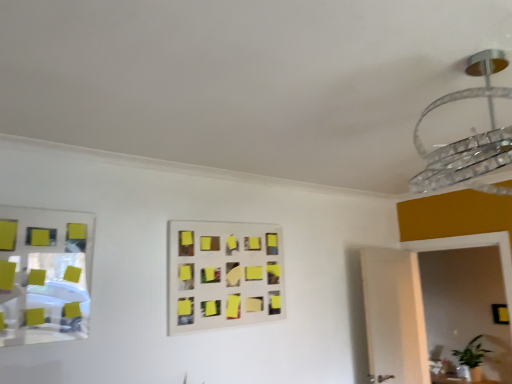
I want to click on metallic reflective mirror at left, so click(x=44, y=274).

The width and height of the screenshot is (512, 384). What do you see at coordinates (467, 137) in the screenshot? I see `clear glass chandelier at upper right` at bounding box center [467, 137].

This screenshot has width=512, height=384. What are the coordinates of `metallic reflective mirror at left` in the screenshot? It's located at (44, 274).

Who is taller, clear glass chandelier at upper right or black matte square at lower right?

clear glass chandelier at upper right is taller.

Is clear glass chandelier at upper right not inside black matte square at lower right?

Indeed, clear glass chandelier at upper right is completely outside black matte square at lower right.

Which of these two, clear glass chandelier at upper right or black matte square at lower right, is smaller?

With smaller size is black matte square at lower right.

Which object is wider, clear glass chandelier at upper right or black matte square at lower right?

With larger width is clear glass chandelier at upper right.

In terms of height, does black matte square at lower right look taller or shorter compared to yellow sticky notes at center?

In the image, black matte square at lower right appears to be shorter than yellow sticky notes at center.

Does black matte square at lower right lie behind yellow sticky notes at center?

That is True.

Choose the correct answer: Is black matte square at lower right inside yellow sticky notes at center or outside it?

black matte square at lower right cannot be found inside yellow sticky notes at center.

From the image's perspective, is black matte square at lower right located above or below yellow sticky notes at center?

From the image's perspective, black matte square at lower right appears below yellow sticky notes at center.

Is yellow sticky notes at center to the left of clear glass chandelier at upper right from the viewer's perspective?

Yes.

Considering the relative sizes of yellow sticky notes at center and clear glass chandelier at upper right in the image provided, is yellow sticky notes at center taller than clear glass chandelier at upper right?

Yes, yellow sticky notes at center is taller than clear glass chandelier at upper right.

Is yellow sticky notes at center bigger than clear glass chandelier at upper right?

Actually, yellow sticky notes at center might be smaller than clear glass chandelier at upper right.

From a real-world perspective, which object rests below the other?

In real-world perspective, yellow sticky notes at center is lower.

Considering the relative sizes of black matte square at lower right and metallic reflective mirror at left in the image provided, is black matte square at lower right taller than metallic reflective mirror at left?

In fact, black matte square at lower right may be shorter than metallic reflective mirror at left.

Measure the distance from black matte square at lower right to metallic reflective mirror at left.

The distance of black matte square at lower right from metallic reflective mirror at left is 3.98 meters.

Does point (504, 311) appear closer or farther from the camera than point (81, 240)?

Point (504, 311) is farther from the camera than point (81, 240).

Which of these two, black matte square at lower right or metallic reflective mirror at left, is smaller?

black matte square at lower right is smaller.

From the image's perspective, is yellow sticky notes at center positioned above or below black matte square at lower right?

Based on their image positions, yellow sticky notes at center is located above black matte square at lower right.

Considering the relative positions of yellow sticky notes at center and black matte square at lower right in the image provided, is yellow sticky notes at center behind black matte square at lower right?

That is False.

Considering the relative sizes of yellow sticky notes at center and black matte square at lower right in the image provided, is yellow sticky notes at center shorter than black matte square at lower right?

No, yellow sticky notes at center is not shorter than black matte square at lower right.

The width and height of the screenshot is (512, 384). Find the location of `square lying below the yellow sticky notes at center (from the image's perspective)`. square lying below the yellow sticky notes at center (from the image's perspective) is located at coordinates tap(500, 313).

Considering the sizes of objects clear glass chandelier at upper right and yellow sticky notes at center in the image provided, who is bigger, clear glass chandelier at upper right or yellow sticky notes at center?

clear glass chandelier at upper right is bigger.

Are clear glass chandelier at upper right and yellow sticky notes at center far apart?

Indeed, clear glass chandelier at upper right is not near yellow sticky notes at center.

Does point (416, 181) come in front of point (202, 291)?

Yes, it is.

Consider the image. Can you confirm if clear glass chandelier at upper right is taller than yellow sticky notes at center?

No, clear glass chandelier at upper right is not taller than yellow sticky notes at center.

Which of these two, clear glass chandelier at upper right or metallic reflective mirror at left, is thinner?

With smaller width is metallic reflective mirror at left.

Which object is further away from the camera taking this photo, clear glass chandelier at upper right or metallic reflective mirror at left?

metallic reflective mirror at left.

From the image's perspective, is clear glass chandelier at upper right located above or below metallic reflective mirror at left?

clear glass chandelier at upper right is situated higher than metallic reflective mirror at left in the image.

The width and height of the screenshot is (512, 384). I want to click on square beneath the clear glass chandelier at upper right (from a real-world perspective), so click(x=500, y=313).

Locate an element on the screen. rectangle on the left of black matte square at lower right is located at coordinates (223, 274).

From the picture: Considering their positions, is yellow sticky notes at center positioned closer to clear glass chandelier at upper right than metallic reflective mirror at left?

The object closer to clear glass chandelier at upper right is yellow sticky notes at center.

Consider the image. From the image, which object appears to be farther from metallic reflective mirror at left, black matte square at lower right or yellow sticky notes at center?

black matte square at lower right is further to metallic reflective mirror at left.

When comparing their distances from metallic reflective mirror at left, does clear glass chandelier at upper right or yellow sticky notes at center seem further?

clear glass chandelier at upper right lies further to metallic reflective mirror at left than the other object.

From the image, which object appears to be nearer to metallic reflective mirror at left, black matte square at lower right or clear glass chandelier at upper right?

The object closer to metallic reflective mirror at left is clear glass chandelier at upper right.

Based on their spatial positions, is metallic reflective mirror at left or black matte square at lower right closer to clear glass chandelier at upper right?

metallic reflective mirror at left is closer to clear glass chandelier at upper right.

Considering their positions, is clear glass chandelier at upper right positioned further to black matte square at lower right than yellow sticky notes at center?

The object further to black matte square at lower right is clear glass chandelier at upper right.

Estimate the real-world distances between objects in this image. Which object is further from clear glass chandelier at upper right, yellow sticky notes at center or black matte square at lower right?

black matte square at lower right lies further to clear glass chandelier at upper right than the other object.

Based on their spatial positions, is metallic reflective mirror at left or clear glass chandelier at upper right closer to black matte square at lower right?

Based on the image, clear glass chandelier at upper right appears to be nearer to black matte square at lower right.

Identify the location of rectangle between clear glass chandelier at upper right and black matte square at lower right in the front-back direction. (223, 274).

This screenshot has height=384, width=512. Identify the location of rectangle between metallic reflective mirror at left and black matte square at lower right in the horizontal direction. (223, 274).

This screenshot has height=384, width=512. Find the location of `lamp between metallic reflective mirror at left and black matte square at lower right`. lamp between metallic reflective mirror at left and black matte square at lower right is located at coordinates (467, 137).

Locate an element on the screen. rectangle between metallic reflective mirror at left and clear glass chandelier at upper right from left to right is located at coordinates (223, 274).